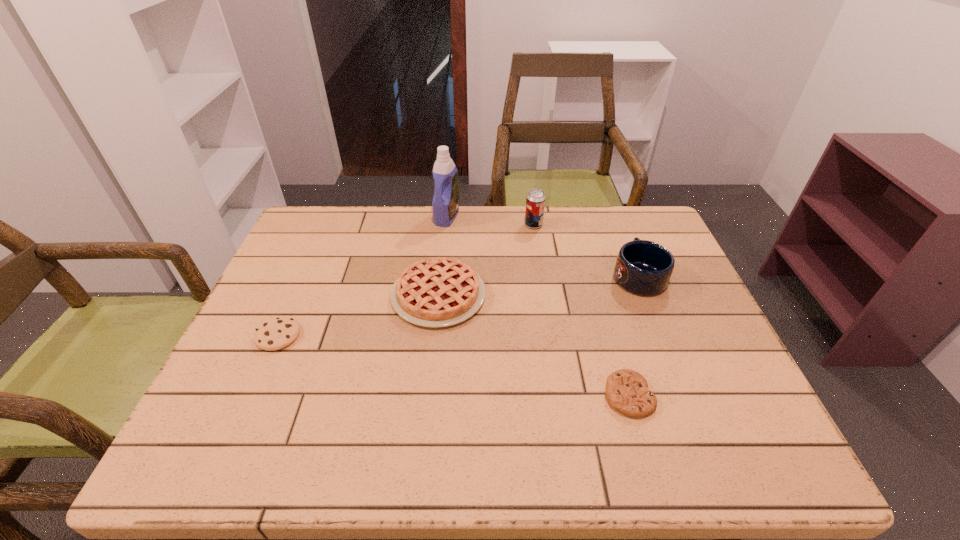
This screenshot has width=960, height=540. I want to click on free point that satisfies the following two spatial constraints: 1. on the back side of the fourth tallest object; 2. on the right side of the detergent, so click(x=446, y=217).

This screenshot has width=960, height=540. What are the coordinates of `free spot that satisfies the following two spatial constraints: 1. on the front side of the left cookie; 2. on the right side of the nearer cookie` in the screenshot? It's located at (252, 395).

You are a GUI agent. You are given a task and a screenshot of the screen. Output one action in this format:
    pyautogui.click(x=<x>, y=<y>)
    Task: Click on the blank area in the image that satisfies the following two spatial constraints: 1. on the front side of the detergent; 2. on the left side of the fourth object from left to right
    Image resolution: width=960 pixels, height=540 pixels.
    Given the screenshot: What is the action you would take?
    pyautogui.click(x=445, y=225)